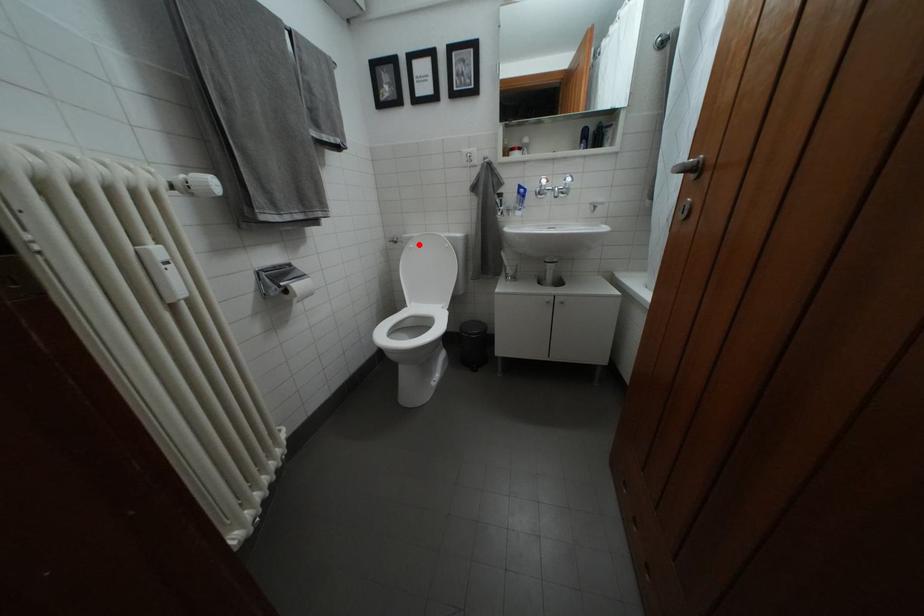
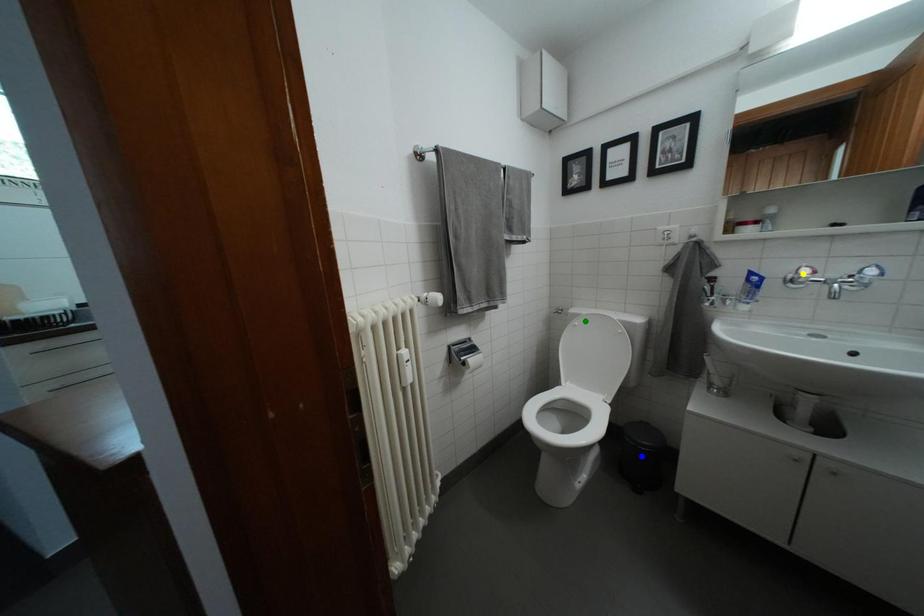
Question: I am providing you with two images of the same scene from different viewpoints. A red point is marked on the first image. You are given multiple points on the second image. Can you choose the point in image 2 that corresponds to the point in image 1?

Choices:
 (A) green point
 (B) blue point
 (C) yellow point

Answer: (A)